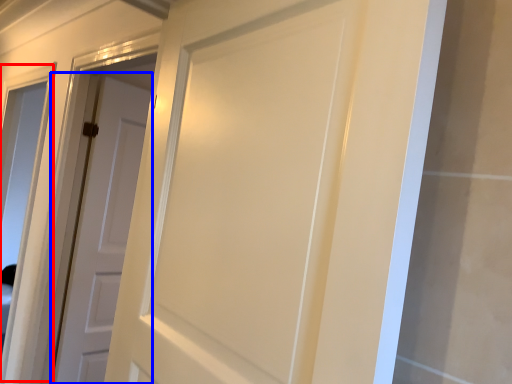
Question: Which object is closer to the camera taking this photo, window (highlighted by a red box) or door (highlighted by a blue box)?

Choices:
 (A) window
 (B) door

Answer: (B)